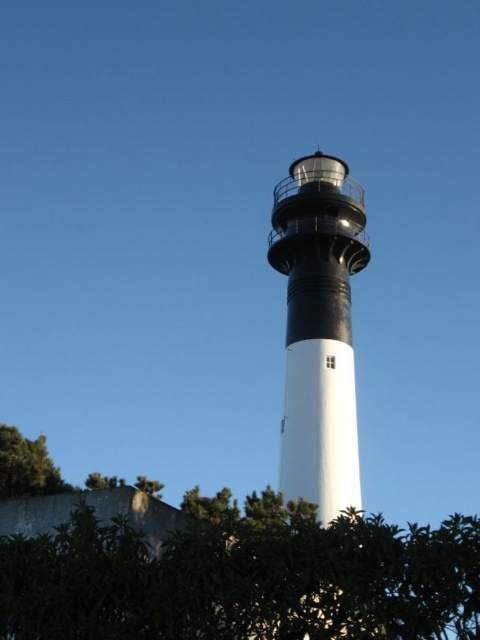
You are standing at the camera position looking at the lighthouse. If you walk straight towards the lighthouse for 20 meters, will you be closer to the point at coordinates point (252, 596) than 20 meters?

Yes, because the distance between the camera and the point is 32.29 meters. After walking 20 meters, you will be 12.29 meters away from the point, which is less than 20 meters.

You are standing at the base of the lighthouse and want to walk towards the green leafy tree at lower left. However, there is a green leafy hedge at lower left in your path. Which obstacle is wider and might block your way?

The green leafy hedge at lower left might be wider than green leafy tree at lower left, so the hedge could block your path more than the tree.

You are standing at the base of the lighthouse and looking towards the green leafy hedge at lower left. Can you see the point marked at coordinates (244, 580) on the hedge?

Yes, the point marked at coordinates (244, 580) is located on the green leafy hedge at lower left, so it is visible from the base of the lighthouse.